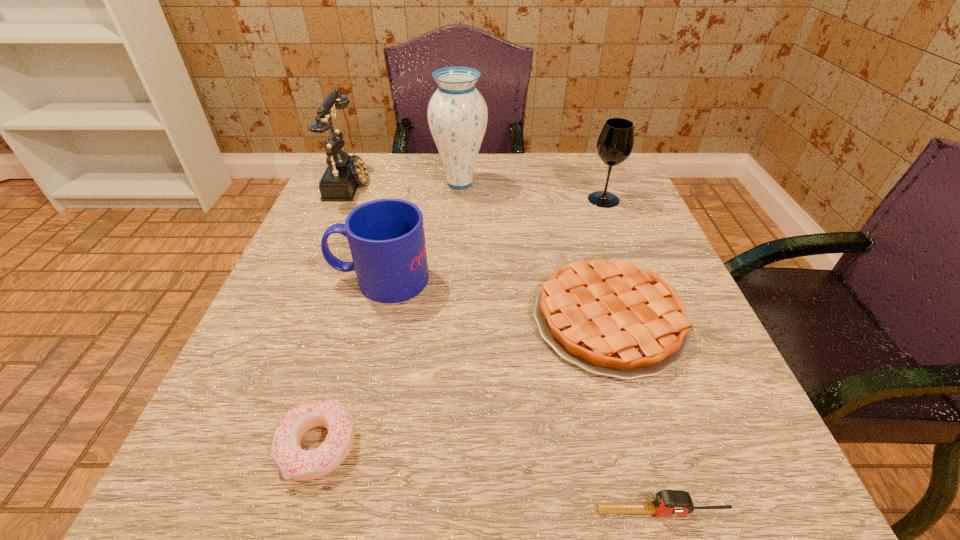
Locate an element on the screen. vase is located at coordinates (457, 113).

Identify the location of telephone. (344, 173).

Identify the location of wineglass. (615, 143).

Where is `mug`? The height and width of the screenshot is (540, 960). mug is located at coordinates (386, 237).

Image resolution: width=960 pixels, height=540 pixels. Identify the location of pie. (609, 318).

Locate an element on the screen. the second nearest object is located at coordinates (293, 462).

This screenshot has height=540, width=960. In order to click on tape measure in this screenshot , I will do `click(669, 503)`.

Find the location of a particular element. The height and width of the screenshot is (540, 960). free space located on the left of the tallest object is located at coordinates point(354,184).

Find the location of `vacant space located 0.360m on the dial of the telephone`. vacant space located 0.360m on the dial of the telephone is located at coordinates (518, 181).

I want to click on free region located 0.120m on the left of the wineglass, so click(x=535, y=199).